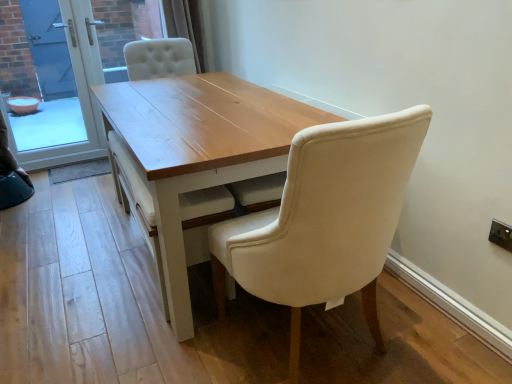
The width and height of the screenshot is (512, 384). In order to click on vacant region to the left of light wood table at center in this screenshot , I will do `click(65, 240)`.